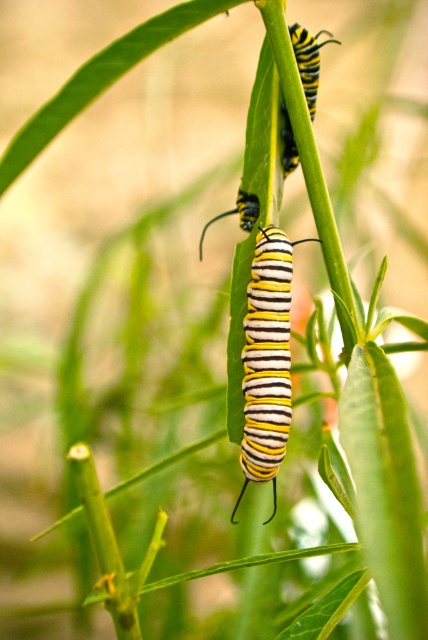
Question: Is yellow striped caterpillar at center further to camera compared to yellow striped caterpillar at upper center?

Choices:
 (A) no
 (B) yes

Answer: (A)

Question: Does yellow striped caterpillar at center appear over yellow striped caterpillar at upper center?

Choices:
 (A) no
 (B) yes

Answer: (A)

Question: Is yellow striped caterpillar at center closer to camera compared to yellow striped caterpillar at upper center?

Choices:
 (A) no
 (B) yes

Answer: (B)

Question: Which of the following is the closest to the observer?

Choices:
 (A) yellow striped caterpillar at center
 (B) yellow striped caterpillar at upper center

Answer: (A)